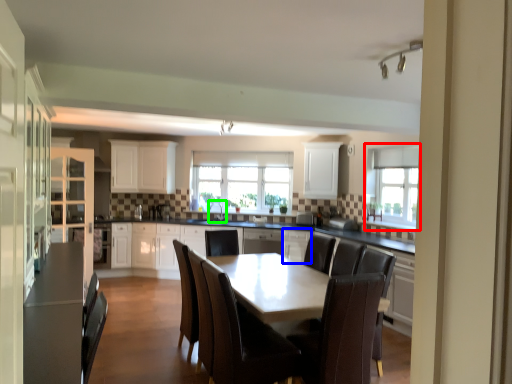
Question: Which object is the farthest from window (highlighted by a red box)? Choose among these: cabinetry (highlighted by a blue box) or sink (highlighted by a green box).

Choices:
 (A) cabinetry
 (B) sink

Answer: (B)